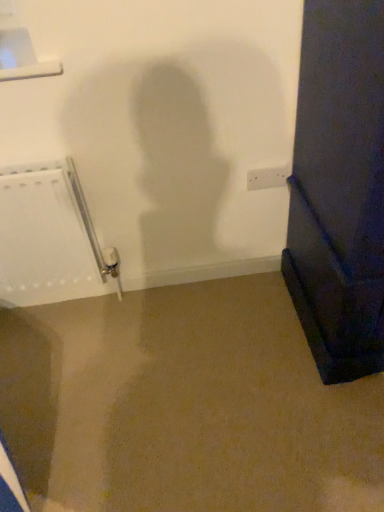
Question: In terms of size, does white matte radiator at left appear bigger or smaller than white plastic electric outlet at center?

Choices:
 (A) big
 (B) small

Answer: (A)

Question: Is white matte radiator at left in front of or behind white plastic electric outlet at center in the image?

Choices:
 (A) front
 (B) behind

Answer: (A)

Question: From a real-world perspective, relative to white plastic electric outlet at center, is white matte radiator at left vertically above or below?

Choices:
 (A) above
 (B) below

Answer: (B)

Question: Relative to white matte radiator at left, is white plastic electric outlet at center in front or behind?

Choices:
 (A) behind
 (B) front

Answer: (A)

Question: Is white plastic electric outlet at center wider or thinner than white matte radiator at left?

Choices:
 (A) wide
 (B) thin

Answer: (B)

Question: From the image's perspective, is white plastic electric outlet at center located above or below white matte radiator at left?

Choices:
 (A) below
 (B) above

Answer: (B)

Question: Is point (271, 176) positioned closer to the camera than point (23, 243)?

Choices:
 (A) closer
 (B) farther

Answer: (B)